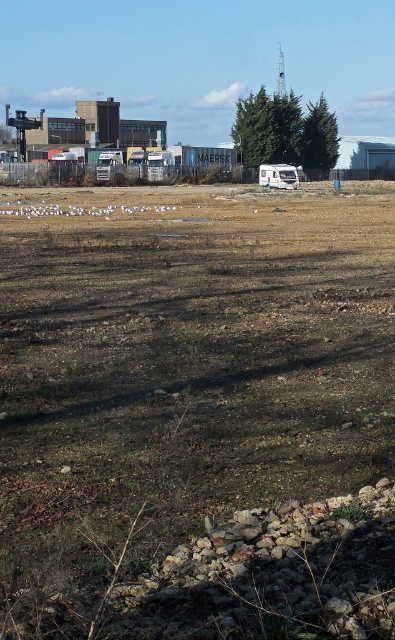
Question: Considering the relative positions of brown soil at center and white plastic camper at center in the image provided, where is brown soil at center located with respect to white plastic camper at center?

Choices:
 (A) below
 (B) above

Answer: (A)

Question: Is brown soil at center positioned behind green textured tree at upper center?

Choices:
 (A) no
 (B) yes

Answer: (A)

Question: Which object appears closest to the camera in this image?

Choices:
 (A) brown soil at center
 (B) green textured tree at upper center

Answer: (A)

Question: Which point is farther from the camera taking this photo?

Choices:
 (A) (248, 96)
 (B) (287, 177)
 (C) (310, 284)
 (D) (327, 125)

Answer: (D)

Question: Does brown soil at center have a lesser width compared to green textured tree at upper center?

Choices:
 (A) yes
 (B) no

Answer: (B)

Question: Which point appears closest to the camera in this image?

Choices:
 (A) (280, 173)
 (B) (174, 259)
 (C) (248, 99)
 (D) (321, 116)

Answer: (B)